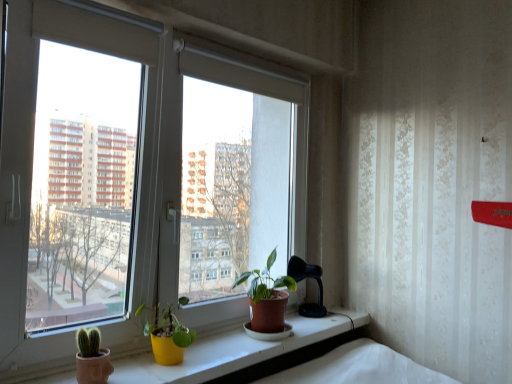
Question: Should I look upward or downward to see matte brown pot at center, the second houseplant positioned from the front?

Choices:
 (A) down
 (B) up

Answer: (A)

Question: From the image's perspective, does yellow matte pot at lower center, which ranks as the second houseplant in back-to-front order, appear higher than matte brown pot at center, placed as the first houseplant when sorted from right to left?

Choices:
 (A) no
 (B) yes

Answer: (A)

Question: Can you confirm if yellow matte pot at lower center, the second houseplant in the right-to-left sequence, is bigger than matte brown pot at center, positioned as the 2th houseplant in left-to-right order?

Choices:
 (A) yes
 (B) no

Answer: (B)

Question: Could matte brown pot at center, positioned as the 2th houseplant in left-to-right order, be considered to be inside yellow matte pot at lower center, the 1th houseplant when ordered from left to right?

Choices:
 (A) yes
 (B) no

Answer: (B)

Question: From the image's perspective, is yellow matte pot at lower center, the second houseplant in the right-to-left sequence, under matte brown pot at center, the second houseplant positioned from the front?

Choices:
 (A) no
 (B) yes

Answer: (B)

Question: Is yellow matte pot at lower center, the second houseplant in the right-to-left sequence, positioned beyond the bounds of matte brown pot at center, positioned as the 1th houseplant in back-to-front order?

Choices:
 (A) no
 (B) yes

Answer: (B)

Question: Does yellow matte pot at lower center, the second houseplant in the right-to-left sequence, have a lesser width compared to matte brown pot at center, the second houseplant positioned from the front?

Choices:
 (A) no
 (B) yes

Answer: (B)

Question: Does matte yellow pot at center appear on the left side of yellow matte pot at lower center, which ranks as the second houseplant in back-to-front order?

Choices:
 (A) no
 (B) yes

Answer: (A)

Question: From a real-world perspective, is matte yellow pot at center on top of yellow matte pot at lower center, the 1th houseplant when ordered from left to right?

Choices:
 (A) yes
 (B) no

Answer: (B)

Question: Is matte yellow pot at center facing away from yellow matte pot at lower center, the first houseplant in the front-to-back sequence?

Choices:
 (A) no
 (B) yes

Answer: (A)

Question: From a real-world perspective, is matte yellow pot at center beneath yellow matte pot at lower center, the first houseplant in the front-to-back sequence?

Choices:
 (A) no
 (B) yes

Answer: (B)

Question: From the image's perspective, is matte yellow pot at center on top of yellow matte pot at lower center, the first houseplant in the front-to-back sequence?

Choices:
 (A) yes
 (B) no

Answer: (B)

Question: Is matte yellow pot at center placed right next to yellow matte pot at lower center, which ranks as the second houseplant in back-to-front order?

Choices:
 (A) yes
 (B) no

Answer: (B)

Question: From the image's perspective, is matte brown pot at center, placed as the first houseplant when sorted from right to left, located beneath white plastic window at center?

Choices:
 (A) yes
 (B) no

Answer: (A)